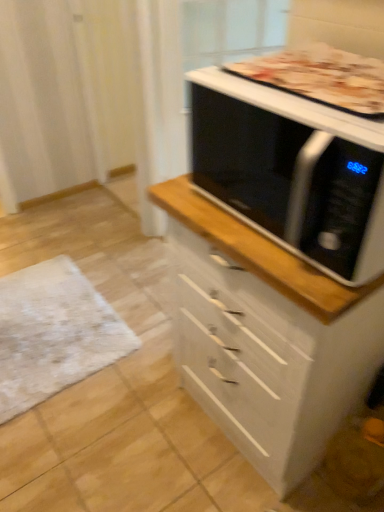
Describe the element at coordinates (321, 77) in the screenshot. I see `golden brown crust at upper right` at that location.

At what (x,y) coordinates should I click in order to perform the action: click on black glossy microwave at upper right. Please return your answer as a coordinate pair (x, y). Looking at the image, I should click on (291, 170).

The width and height of the screenshot is (384, 512). Find the location of `white glossy chest of drawers at center`. white glossy chest of drawers at center is located at coordinates (266, 337).

The width and height of the screenshot is (384, 512). Identify the location of white textured mat at lower left. (53, 333).

From the picture: Is golden brown crust at upper right bigger than white glossy chest of drawers at center?

Actually, golden brown crust at upper right might be smaller than white glossy chest of drawers at center.

Is golden brown crust at upper right wider than white glossy chest of drawers at center?

In fact, golden brown crust at upper right might be narrower than white glossy chest of drawers at center.

Is golden brown crust at upper right situated inside white glossy chest of drawers at center or outside?

golden brown crust at upper right is outside white glossy chest of drawers at center.

Identify the location of the chest of drawers lying behind the golden brown crust at upper right. The image size is (384, 512). (266, 337).

Can you confirm if golden brown crust at upper right is thinner than black glossy microwave at upper right?

Correct, the width of golden brown crust at upper right is less than that of black glossy microwave at upper right.

Is golden brown crust at upper right oriented towards black glossy microwave at upper right?

No, golden brown crust at upper right is not turned towards black glossy microwave at upper right.

Which object is positioned more to the right, golden brown crust at upper right or black glossy microwave at upper right?

golden brown crust at upper right.

From a real-world perspective, who is located lower, golden brown crust at upper right or black glossy microwave at upper right?

black glossy microwave at upper right is physically lower.

Is black glossy microwave at upper right far from golden brown crust at upper right?

No, there isn't a large distance between black glossy microwave at upper right and golden brown crust at upper right.

Identify the location of pizza behind the black glossy microwave at upper right. The image size is (384, 512). (321, 77).

Considering the points (212, 168) and (374, 89), which point is behind, point (212, 168) or point (374, 89)?

Point (212, 168)

Is white glossy chest of drawers at center positioned far away from golden brown crust at upper right?

white glossy chest of drawers at center is near golden brown crust at upper right, not far away.

Who is bigger, white glossy chest of drawers at center or golden brown crust at upper right?

Bigger between the two is white glossy chest of drawers at center.

From a real-world perspective, relative to golden brown crust at upper right, is white glossy chest of drawers at center vertically above or below?

From a real-world perspective, white glossy chest of drawers at center is physically below golden brown crust at upper right.

Does white glossy chest of drawers at center have a greater width compared to golden brown crust at upper right?

Indeed, white glossy chest of drawers at center has a greater width compared to golden brown crust at upper right.

Considering the sizes of objects white textured mat at lower left and white glossy chest of drawers at center in the image provided, who is shorter, white textured mat at lower left or white glossy chest of drawers at center?

With less height is white textured mat at lower left.

From the picture: From the image's perspective, which one is positioned lower, white textured mat at lower left or white glossy chest of drawers at center?

From the image's view, white textured mat at lower left is below.

Is white textured mat at lower left far from white glossy chest of drawers at center?

white textured mat at lower left is near white glossy chest of drawers at center, not far away.

Can you tell me how much white textured mat at lower left and white glossy chest of drawers at center differ in facing direction?

They differ by 87.4 degrees in their facing directions.

In the scene shown: Is white glossy chest of drawers at center bigger than black glossy microwave at upper right?

Yes.

Which is less distant, (267, 403) or (248, 183)?

Positioned in front is point (248, 183).

Can you confirm if white glossy chest of drawers at center is positioned to the right of black glossy microwave at upper right?

No.

In the scene shown: Is white textured mat at lower left at the back of white glossy chest of drawers at center?

No, white glossy chest of drawers at center's orientation is not away from white textured mat at lower left.

Where is `mat behind the white glossy chest of drawers at center`? This screenshot has height=512, width=384. mat behind the white glossy chest of drawers at center is located at coordinates (53, 333).

Is white glossy chest of drawers at center completely or partially outside of white textured mat at lower left?

Absolutely, white glossy chest of drawers at center is external to white textured mat at lower left.

Identify the location of the chest of drawers lying below the golden brown crust at upper right (from the image's perspective). The width and height of the screenshot is (384, 512). (266, 337).

The image size is (384, 512). Identify the location of microwave oven on the left of golden brown crust at upper right. (291, 170).

Considering their positions, is black glossy microwave at upper right positioned closer to white glossy chest of drawers at center than white textured mat at lower left?

Based on the image, black glossy microwave at upper right appears to be nearer to white glossy chest of drawers at center.

Which object lies further to the anchor point white textured mat at lower left, white glossy chest of drawers at center or golden brown crust at upper right?

golden brown crust at upper right is further to white textured mat at lower left.

Based on their spatial positions, is white glossy chest of drawers at center or golden brown crust at upper right closer to black glossy microwave at upper right?

golden brown crust at upper right is closer to black glossy microwave at upper right.

When comparing their distances from white glossy chest of drawers at center, does golden brown crust at upper right or white textured mat at lower left seem closer?

golden brown crust at upper right is positioned closer to the anchor white glossy chest of drawers at center.

From the picture: Which object lies nearer to the anchor point white glossy chest of drawers at center, black glossy microwave at upper right or golden brown crust at upper right?

The object closer to white glossy chest of drawers at center is black glossy microwave at upper right.

Based on the photo, looking at the image, which one is located closer to white textured mat at lower left, white glossy chest of drawers at center or black glossy microwave at upper right?

The object closer to white textured mat at lower left is white glossy chest of drawers at center.

Estimate the real-world distances between objects in this image. Which object is closer to white textured mat at lower left, golden brown crust at upper right or white glossy chest of drawers at center?

white glossy chest of drawers at center.

From the image, which object appears to be farther from white textured mat at lower left, black glossy microwave at upper right or golden brown crust at upper right?

Among the two, golden brown crust at upper right is located further to white textured mat at lower left.

Find the location of a particular element. microwave oven between white textured mat at lower left and golden brown crust at upper right is located at coordinates (291, 170).

This screenshot has width=384, height=512. I want to click on microwave oven between golden brown crust at upper right and white glossy chest of drawers at center from top to bottom, so click(x=291, y=170).

The image size is (384, 512). I want to click on chest of drawers between white textured mat at lower left and golden brown crust at upper right, so click(266, 337).

You are a GUI agent. You are given a task and a screenshot of the screen. Output one action in this format:
    pyautogui.click(x=<x>, y=<y>)
    Task: Click on the chest of drawers between white textured mat at lower left and black glossy microwave at upper right from left to right
    
    Given the screenshot: What is the action you would take?
    pyautogui.click(x=266, y=337)